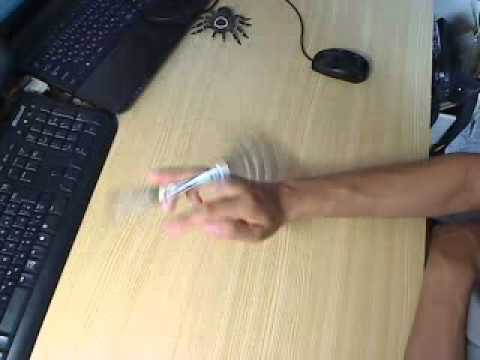
Identify the location of keyboard. click(50, 160), click(128, 41).